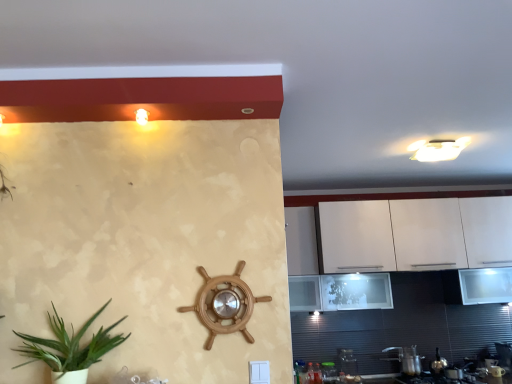
Question: From the image's perspective, is white glossy cabinet at right above or below metallic silver pot at lower right, which is the second appliance from left to right?

Choices:
 (A) above
 (B) below

Answer: (A)

Question: Does point (466, 350) appear closer or farther from the camera than point (396, 357)?

Choices:
 (A) farther
 (B) closer

Answer: (A)

Question: Which is nearer to the metallic silver pot at lower right, which is the second appliance from left to right?

Choices:
 (A) white glossy cabinet at right
 (B) transparent glass jar at lower right, which is the 1th appliance in left-to-right order
 (C) matte white light fixture at upper left
 (D) metallic silver kettle at lower right, the first appliance viewed from the right
 (E) metallic silver gas stove at lower right

Answer: (E)

Question: Which is farther from the metallic silver gas stove at lower right?

Choices:
 (A) metallic silver pot at lower right, which is the second appliance from left to right
 (B) white glossy cabinet at right
 (C) transparent glass jar at lower right, which is the 1th appliance in left-to-right order
 (D) green leafy plant in pot at lower left
 (E) matte white light fixture at upper left

Answer: (E)